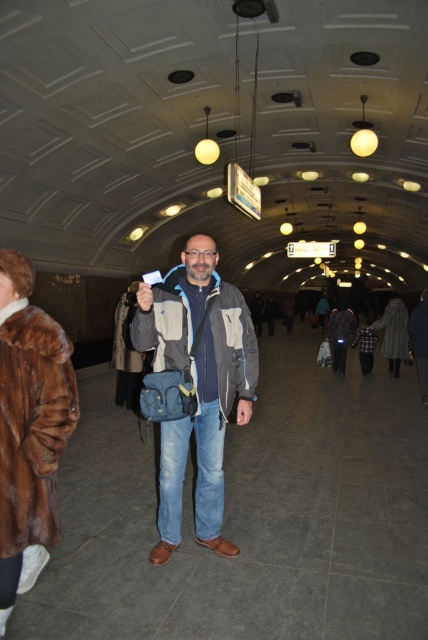
You are taking a photo of the subway station and want to focus on both the man in the foreground and the ceiling lights. Which of the two points, point (142, 314) or point (12, 404), is closer to the camera?

Point (142, 314) is further to the camera than point (12, 404), so point (12, 404) is closer to the camera.